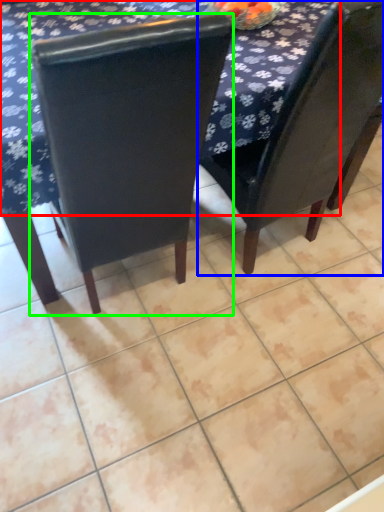
Question: Considering the real-world distances, which object is farthest from tablecloth (highlighted by a red box)? chair (highlighted by a blue box) or chair (highlighted by a green box)?

Choices:
 (A) chair
 (B) chair

Answer: (A)